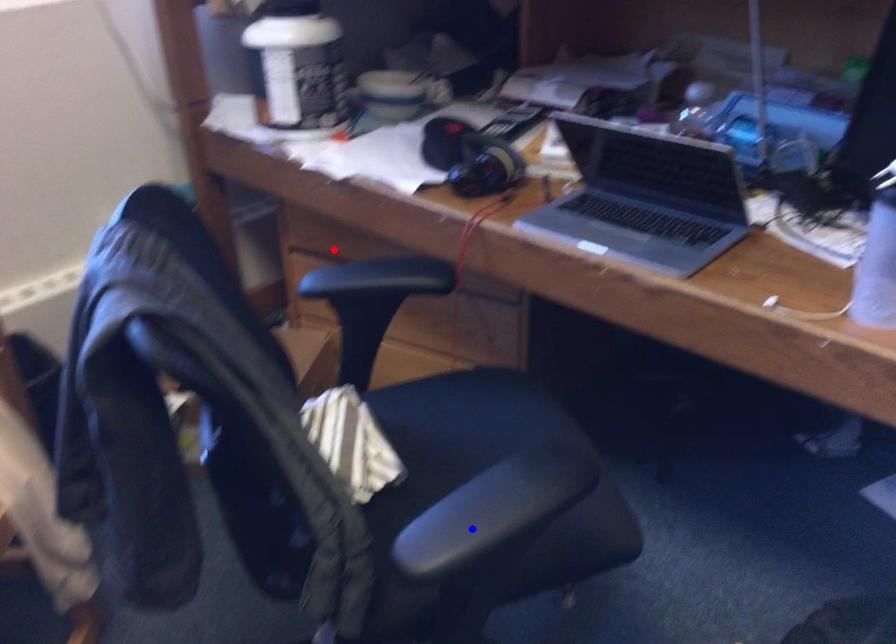
Question: In the image, two points are highlighted. Which point is nearer to the camera? Reply with the corresponding letter.

Choices:
 (A) blue point
 (B) red point

Answer: (A)